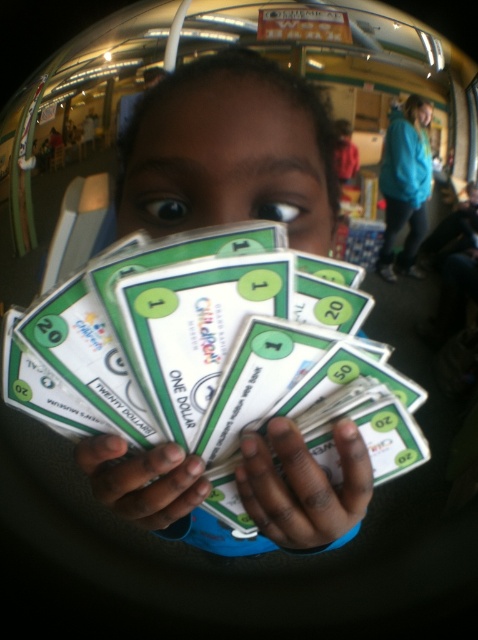
Question: Is matte green paper money at center wider than smooth skin face at center?

Choices:
 (A) yes
 (B) no

Answer: (A)

Question: Can you confirm if matte green paper money at center is smaller than blue fleece jacket at upper right?

Choices:
 (A) no
 (B) yes

Answer: (A)

Question: Which point appears closest to the camera in this image?

Choices:
 (A) (109, 483)
 (B) (397, 212)

Answer: (A)

Question: Which of the following is the closest to the observer?

Choices:
 (A) smooth skin face at center
 (B) smooth plastic hand at center

Answer: (B)

Question: Can you confirm if white paper money at center is thinner than smooth plastic hand at center?

Choices:
 (A) no
 (B) yes

Answer: (A)

Question: Estimate the real-world distances between objects in this image. Which object is farther from the white paper money at center?

Choices:
 (A) smooth skin face at center
 (B) matte green paper money at center
 (C) blue fleece jacket at upper right

Answer: (A)